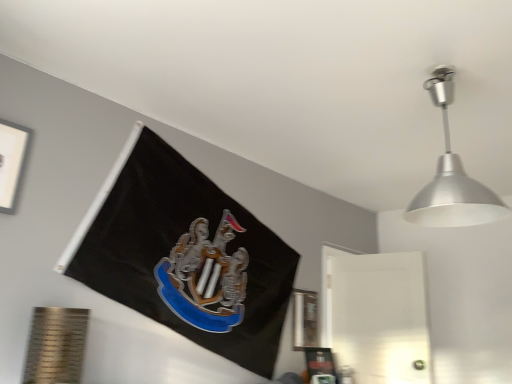
Question: Can you confirm if metallic silver picture frame at lower right, which ranks as the 2th picture frame in front-to-back order, is bigger than white matte picture frame at upper left, the first picture frame when ordered from front to back?

Choices:
 (A) yes
 (B) no

Answer: (B)

Question: From a real-world perspective, is metallic silver picture frame at lower right, which ranks as the second picture frame in top-to-bottom order, beneath white matte picture frame at upper left, which is counted as the 1th picture frame, starting from the top?

Choices:
 (A) yes
 (B) no

Answer: (A)

Question: Can you confirm if metallic silver picture frame at lower right, arranged as the second picture frame when viewed from the left, is smaller than white matte picture frame at upper left, which is counted as the 1th picture frame, starting from the top?

Choices:
 (A) no
 (B) yes

Answer: (B)

Question: Is metallic silver picture frame at lower right, which ranks as the 2th picture frame in front-to-back order, at the left side of white matte picture frame at upper left, the first picture frame when ordered from front to back?

Choices:
 (A) no
 (B) yes

Answer: (A)

Question: Is metallic silver picture frame at lower right, which is counted as the 1th picture frame, starting from the back, not within white matte picture frame at upper left, the second picture frame when ordered from back to front?

Choices:
 (A) no
 (B) yes

Answer: (B)

Question: Is silver metallic lampshade at upper right situated inside white matte picture frame at upper left, the first picture frame when ordered from front to back, or outside?

Choices:
 (A) outside
 (B) inside

Answer: (A)

Question: Is silver metallic lampshade at upper right bigger or smaller than white matte picture frame at upper left, placed as the 1th picture frame when sorted from left to right?

Choices:
 (A) small
 (B) big

Answer: (B)

Question: From a real-world perspective, is silver metallic lampshade at upper right physically located above or below white matte picture frame at upper left, which is counted as the 1th picture frame, starting from the top?

Choices:
 (A) below
 (B) above

Answer: (B)

Question: Is silver metallic lampshade at upper right in front of or behind white matte picture frame at upper left, which is counted as the 1th picture frame, starting from the top, in the image?

Choices:
 (A) front
 (B) behind

Answer: (A)

Question: Is metallic silver picture frame at lower right, which is counted as the 1th picture frame, starting from the back, in front of or behind silver metallic lampshade at upper right in the image?

Choices:
 (A) behind
 (B) front

Answer: (A)

Question: Considering the positions of metallic silver picture frame at lower right, which ranks as the 2th picture frame in front-to-back order, and silver metallic lampshade at upper right in the image, is metallic silver picture frame at lower right, which ranks as the 2th picture frame in front-to-back order, wider or thinner than silver metallic lampshade at upper right?

Choices:
 (A) thin
 (B) wide

Answer: (A)

Question: From a real-world perspective, is metallic silver picture frame at lower right, which ranks as the second picture frame in top-to-bottom order, above or below silver metallic lampshade at upper right?

Choices:
 (A) above
 (B) below

Answer: (B)

Question: From the image's perspective, is metallic silver picture frame at lower right, arranged as the second picture frame when viewed from the left, positioned above or below silver metallic lampshade at upper right?

Choices:
 (A) below
 (B) above

Answer: (A)

Question: From the image's perspective, relative to metallic silver picture frame at lower right, arranged as the second picture frame when viewed from the left, is silver metallic lampshade at upper right above or below?

Choices:
 (A) above
 (B) below

Answer: (A)

Question: Does point (455, 218) appear closer or farther from the camera than point (308, 302)?

Choices:
 (A) closer
 (B) farther

Answer: (A)